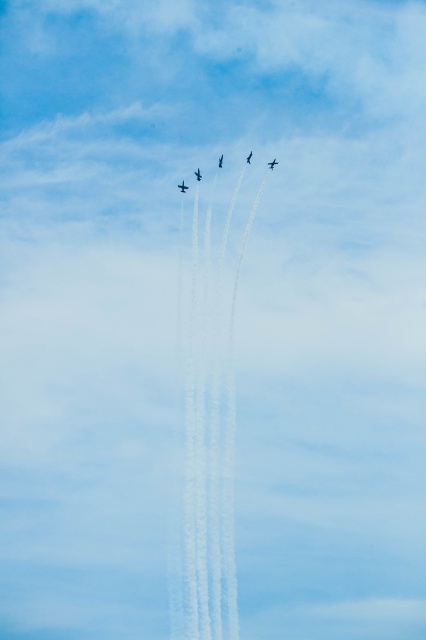
You are a pilot flying a small plane that requires a minimum of 200 meters distance from other aircraft for safe passage. You see the shiny silver airplane at upper center and another aircraft. Can you safely navigate between them?

The shiny silver airplane at upper center and the other aircraft are 244.68 meters apart, which exceeds the required 200 meters for safe passage. Yes, you can safely navigate between them.